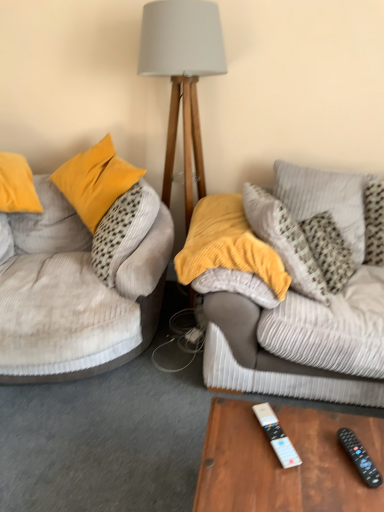
This screenshot has width=384, height=512. Find the location of `vacant area to the right of white plastic remote control at lower center, which appears as the second remote control when viewed from the right`. vacant area to the right of white plastic remote control at lower center, which appears as the second remote control when viewed from the right is located at coordinates (321, 441).